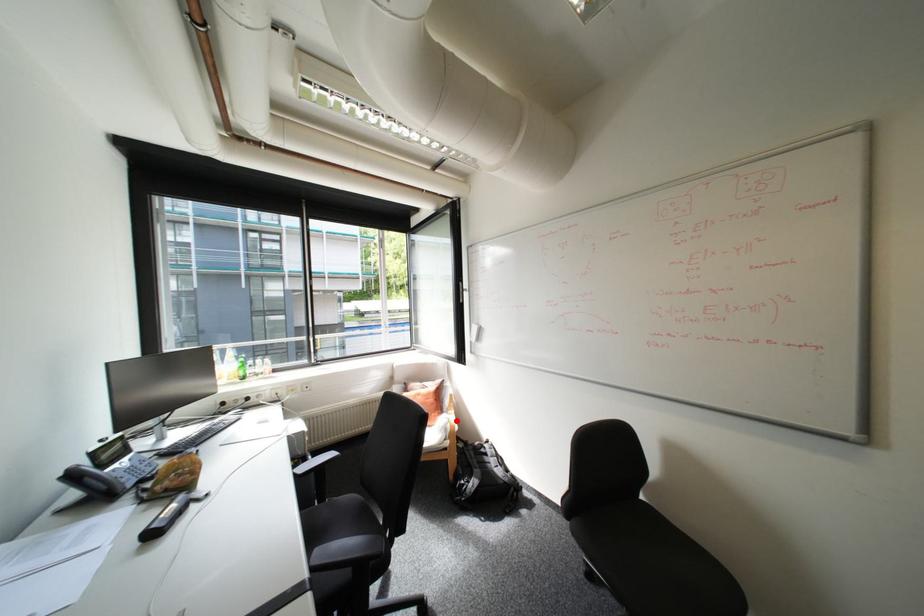
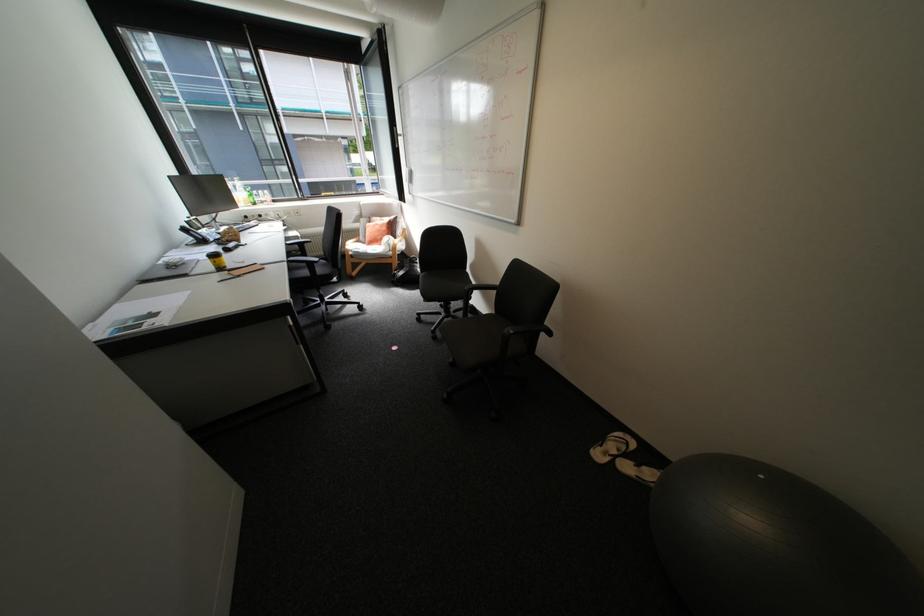
Question: I am providing you with two images of the same scene from different viewpoints. In image1, a red point is highlighted. Considering the same 3D point in image2, which of the following is correct?

Choices:
 (A) It is closer
 (B) It is farther

Answer: (A)